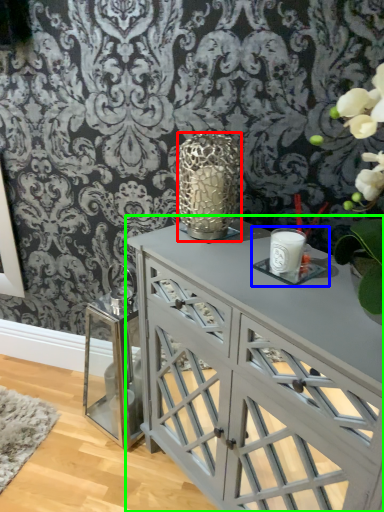
Question: Estimate the real-world distances between objects in this image. Which object is farther from candle holder (highlighted by a red box), candle holder (highlighted by a blue box) or table (highlighted by a green box)?

Choices:
 (A) candle holder
 (B) table

Answer: (B)